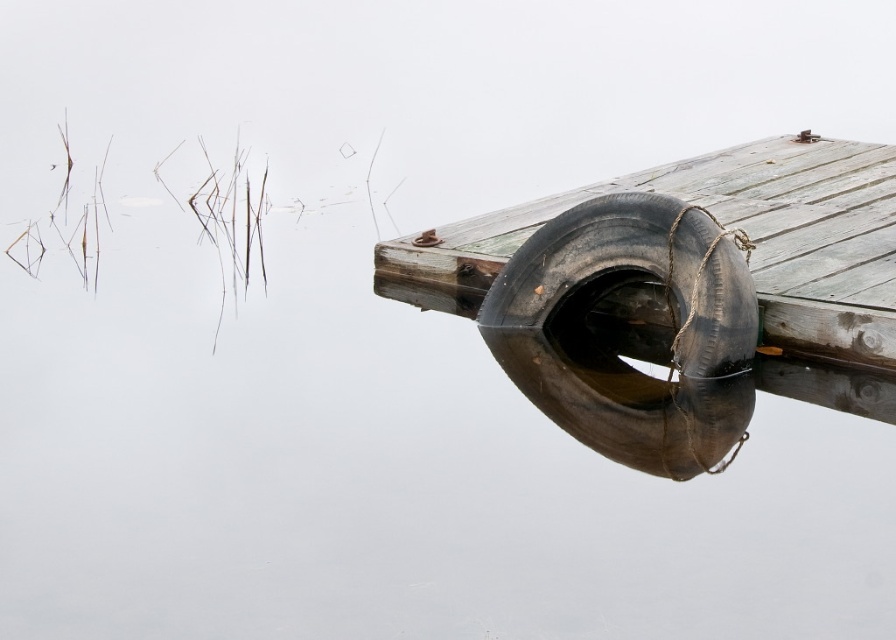
You are a boat operator who needs to secure your boat to the dock. You have two rubber tires available. The rubber tire at center and the black rubber tire at right. You want to tie your boat to the tire that is closest to the center of the dock. Which tire should you choose?

The rubber tire at center is located at the center of the dock, so it is closer to the center than the black rubber tire at right which is 90.56 centimeters away from it. Therefore, you should tie your boat to the rubber tire at center.

You are standing on the wooden dock and want to retrieve the rubber tire at center. What are the coordinates where you should look to find it?

The rubber tire at center is located at coordinates point [739,228].